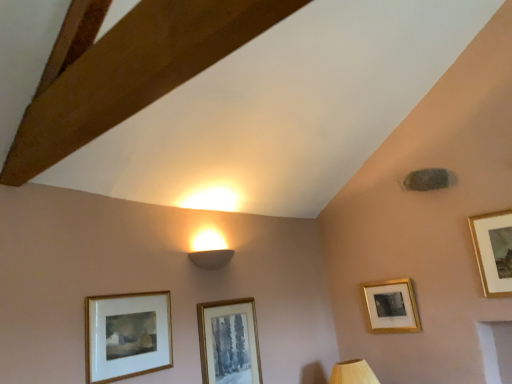
Question: Based on their positions, is white matte wall sconce at upper center located to the left or right of wooden at lower right?

Choices:
 (A) left
 (B) right

Answer: (A)

Question: From the image's perspective, relative to wooden at lower right, is white matte wall sconce at upper center above or below?

Choices:
 (A) above
 (B) below

Answer: (A)

Question: Estimate the real-world distances between objects in this image. Which object is farther from the gold-framed picture at lower left, which is counted as the fourth picture frame, starting from the back?

Choices:
 (A) matte gold picture frame at center, placed as the second picture frame when sorted from front to back
 (B) gold-framed picture at upper right, which ranks as the 1th picture frame in right-to-left order
 (C) white matte wall sconce at upper center
 (D) gold-framed picture at lower right, which appears as the 4th picture frame when viewed from the front
 (E) wooden at lower right

Answer: (B)

Question: Estimate the real-world distances between objects in this image. Which object is closer to the gold-framed picture at lower left, placed as the 1th picture frame when sorted from left to right?

Choices:
 (A) white matte wall sconce at upper center
 (B) wooden at lower right
 (C) gold-framed picture at lower right, placed as the first picture frame when sorted from back to front
 (D) matte gold picture frame at center, which appears as the 3th picture frame when viewed from the right
 (E) gold-framed picture at upper right, which is the third picture frame in front-to-back order

Answer: (D)